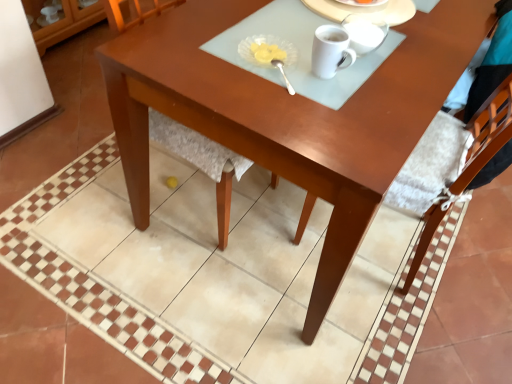
The image size is (512, 384). What are the coordinates of `vacant space positioned to the left of silver metallic spoon at center, the first tableware when ordered from bottom to top` in the screenshot? It's located at (218, 63).